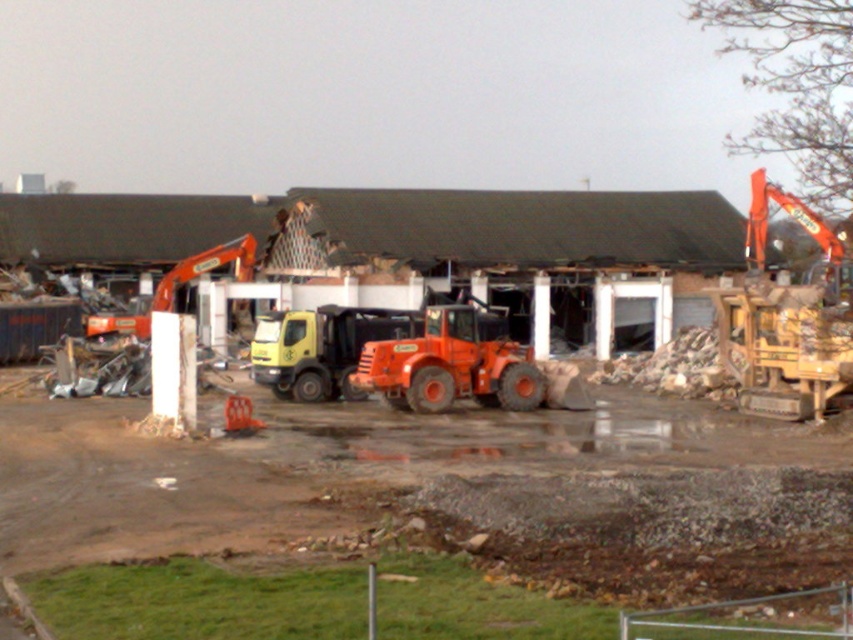
Question: Which object is farther from the camera taking this photo?

Choices:
 (A) orange rubber tractor at center
 (B) orange metallic excavator at left

Answer: (B)

Question: Which of the following is the closest to the observer?

Choices:
 (A) orange metallic excavator at left
 (B) orange rubber tractor at center

Answer: (B)

Question: Can you confirm if orange rubber tractor at center is positioned to the left of orange metallic excavator at left?

Choices:
 (A) yes
 (B) no

Answer: (B)

Question: Is orange rubber tractor at center positioned before orange metallic excavator at left?

Choices:
 (A) yes
 (B) no

Answer: (A)

Question: Does orange rubber tractor at center have a lesser width compared to orange metallic excavator at left?

Choices:
 (A) no
 (B) yes

Answer: (B)